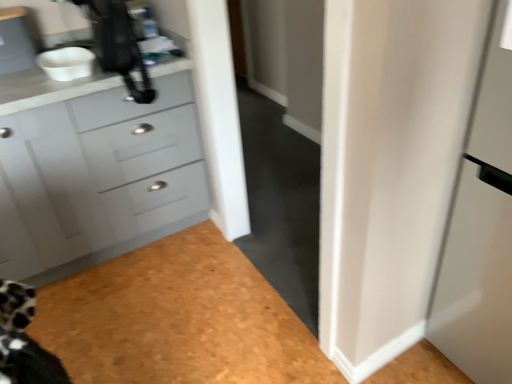
Find the location of `vacant area that is in front of matte gray cabinet at left`. vacant area that is in front of matte gray cabinet at left is located at coordinates (142, 315).